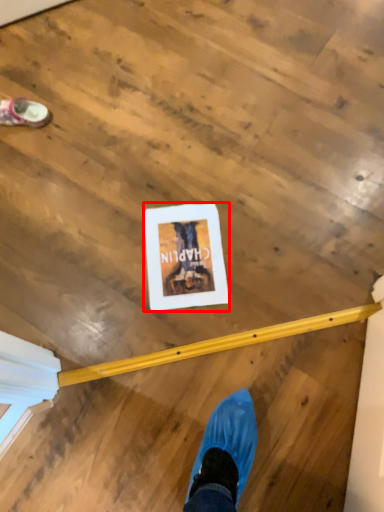
Question: From the image's perspective, where is postcard (annotated by the red box) located in relation to footwear in the image?

Choices:
 (A) above
 (B) below

Answer: (B)